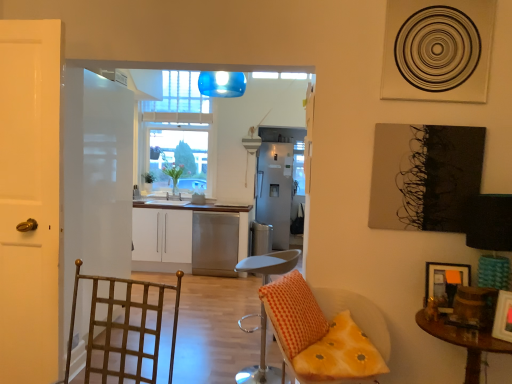
Question: Is yellow fabric cushion at lower right wider than white glossy door at left, positioned as the first door in front-to-back order?

Choices:
 (A) yes
 (B) no

Answer: (A)

Question: Is yellow fabric cushion at lower right to the left of white glossy door at left, acting as the 2th door starting from the left, from the viewer's perspective?

Choices:
 (A) yes
 (B) no

Answer: (B)

Question: Is yellow fabric cushion at lower right positioned with its back to white glossy door at left, which is the 2th door from back to front?

Choices:
 (A) yes
 (B) no

Answer: (B)

Question: Would you say white glossy door at left, positioned as the first door in front-to-back order, is part of yellow fabric cushion at lower right's contents?

Choices:
 (A) yes
 (B) no

Answer: (B)

Question: Is there a large distance between yellow fabric cushion at lower right and white glossy door at left, acting as the 2th door starting from the left?

Choices:
 (A) yes
 (B) no

Answer: (A)

Question: Would you say wooden picture frame at lower right, positioned as the first picture frame in back-to-front order, is inside or outside orange checkered pillow at center?

Choices:
 (A) inside
 (B) outside

Answer: (B)

Question: Considering the positions of wooden picture frame at lower right, positioned as the first picture frame in back-to-front order, and orange checkered pillow at center in the image, is wooden picture frame at lower right, positioned as the first picture frame in back-to-front order, bigger or smaller than orange checkered pillow at center?

Choices:
 (A) big
 (B) small

Answer: (B)

Question: Considering the relative positions of wooden picture frame at lower right, positioned as the first picture frame in back-to-front order, and orange checkered pillow at center in the image provided, is wooden picture frame at lower right, positioned as the first picture frame in back-to-front order, to the left or to the right of orange checkered pillow at center?

Choices:
 (A) right
 (B) left

Answer: (A)

Question: In terms of width, does wooden picture frame at lower right, positioned as the first picture frame in back-to-front order, look wider or thinner when compared to orange checkered pillow at center?

Choices:
 (A) thin
 (B) wide

Answer: (A)

Question: Is white glossy cabinets at center bigger or smaller than yellow fabric cushion at lower right?

Choices:
 (A) small
 (B) big

Answer: (B)

Question: In terms of height, does white glossy cabinets at center look taller or shorter compared to yellow fabric cushion at lower right?

Choices:
 (A) short
 (B) tall

Answer: (B)

Question: Is white glossy cabinets at center spatially inside yellow fabric cushion at lower right, or outside of it?

Choices:
 (A) inside
 (B) outside

Answer: (B)

Question: From the image's perspective, is white glossy cabinets at center positioned above or below yellow fabric cushion at lower right?

Choices:
 (A) below
 (B) above

Answer: (B)

Question: Considering the positions of wooden picture frame at lower right, positioned as the first picture frame in back-to-front order, and clear glass window at center in the image, is wooden picture frame at lower right, positioned as the first picture frame in back-to-front order, bigger or smaller than clear glass window at center?

Choices:
 (A) big
 (B) small

Answer: (B)

Question: Which is correct: wooden picture frame at lower right, positioned as the first picture frame in back-to-front order, is inside clear glass window at center, or outside of it?

Choices:
 (A) inside
 (B) outside

Answer: (B)